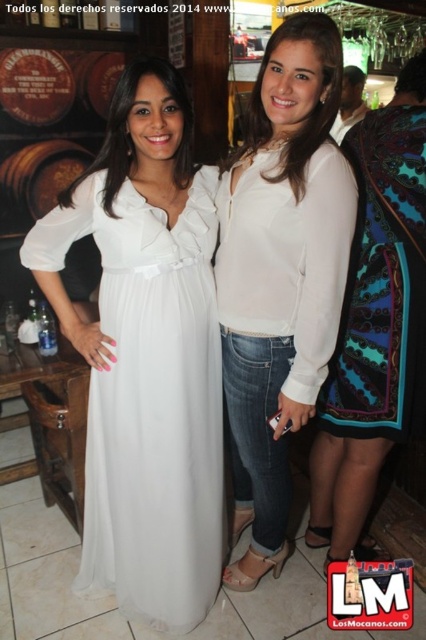
Question: Considering the relative positions of white sheer dress at center and white matte blouse at center in the image provided, where is white sheer dress at center located with respect to white matte blouse at center?

Choices:
 (A) above
 (B) below

Answer: (B)

Question: Which point appears farthest from the camera in this image?

Choices:
 (A) (91, 488)
 (B) (379, 273)
 (C) (299, 42)

Answer: (A)

Question: Which of these objects is positioned closest to the patterned silk dress at right?

Choices:
 (A) white matte blouse at center
 (B) white sheer dress at center

Answer: (A)

Question: Is the position of white sheer dress at center less distant than that of white matte blouse at center?

Choices:
 (A) no
 (B) yes

Answer: (A)

Question: Which object is positioned farthest from the patterned silk dress at right?

Choices:
 (A) white matte blouse at center
 (B) white sheer dress at center

Answer: (B)

Question: Where is white sheer dress at center located in relation to patterned silk dress at right in the image?

Choices:
 (A) right
 (B) left

Answer: (B)